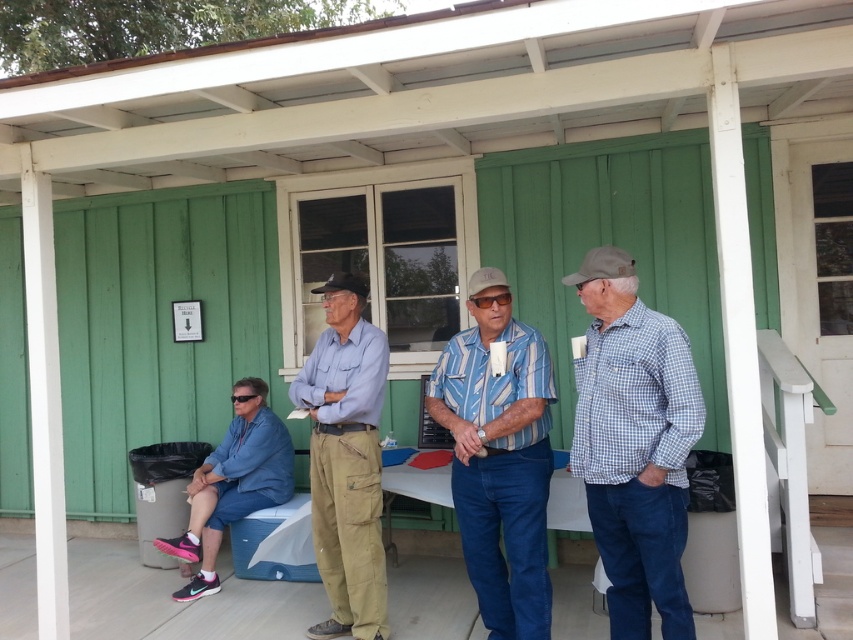
You are a photographer trying to capture a group photo of the white checkered shirt at right and the blue striped shirt at center. To ensure both are in the frame, should you position the camera to the left or the right of the group?

The white checkered shirt at right is positioned on the right side of the blue striped shirt at center. To include both in the frame, position the camera to the left of the group so that both the right and center shirts are visible.